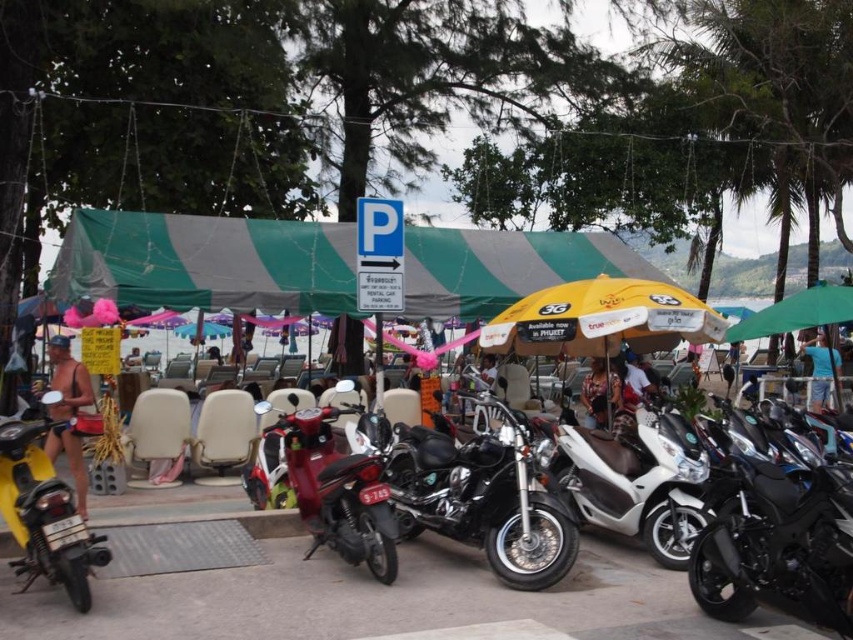
Is point (65, 433) positioned in front of point (828, 369)?

Yes, it is.

The image size is (853, 640). I want to click on matte red shorts at left, so click(68, 381).

In order to click on matte red shorts at left in this screenshot , I will do `click(68, 381)`.

Describe the element at coordinates (206, 262) in the screenshot. The height and width of the screenshot is (640, 853). I see `green fabric canopy at center` at that location.

Describe the element at coordinates (206, 262) in the screenshot. Image resolution: width=853 pixels, height=640 pixels. I see `green fabric canopy at center` at that location.

This screenshot has width=853, height=640. I want to click on green fabric canopy at center, so click(x=206, y=262).

Between point (297, 422) and point (843, 298), which one is positioned behind?

Point (843, 298)

Who is more distant from viewer, (387, 490) or (734, 340)?

Point (734, 340)

At what (x,y) coordinates should I click in order to perform the action: click on shiny red motorcycle at center. Please return your answer as a coordinate pair (x, y). The width and height of the screenshot is (853, 640). Looking at the image, I should click on (325, 488).